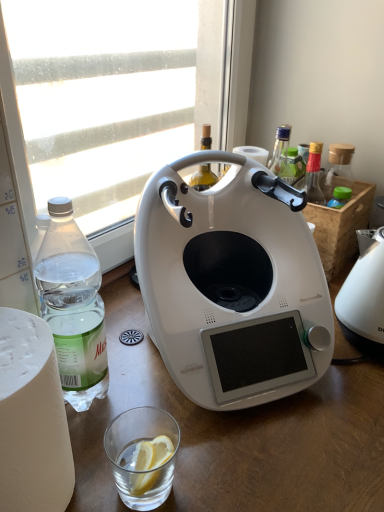
Question: Is transparent glass window at upper left thinner than clear plastic bottle at left?

Choices:
 (A) yes
 (B) no

Answer: (A)

Question: Are transparent glass window at upper left and clear plastic bottle at left making contact?

Choices:
 (A) yes
 (B) no

Answer: (B)

Question: Is transparent glass window at upper left aimed at clear plastic bottle at left?

Choices:
 (A) no
 (B) yes

Answer: (B)

Question: Is transparent glass window at upper left located outside clear plastic bottle at left?

Choices:
 (A) yes
 (B) no

Answer: (A)

Question: Is transparent glass window at upper left shorter than clear plastic bottle at left?

Choices:
 (A) yes
 (B) no

Answer: (B)

Question: Is transparent glass window at upper left facing away from clear plastic bottle at left?

Choices:
 (A) no
 (B) yes

Answer: (A)

Question: Could you tell me if white glossy coffee maker at center, which is counted as the first kitchen appliance, starting from the left, is turned towards clear glass at lower center?

Choices:
 (A) yes
 (B) no

Answer: (B)

Question: Considering the relative sizes of white glossy coffee maker at center, which is counted as the first kitchen appliance, starting from the left, and clear glass at lower center in the image provided, is white glossy coffee maker at center, which is counted as the first kitchen appliance, starting from the left, thinner than clear glass at lower center?

Choices:
 (A) yes
 (B) no

Answer: (B)

Question: Is white glossy coffee maker at center, which is counted as the first kitchen appliance, starting from the left, positioned beyond the bounds of clear glass at lower center?

Choices:
 (A) no
 (B) yes

Answer: (B)

Question: Considering the relative positions of white glossy coffee maker at center, which is counted as the first kitchen appliance, starting from the left, and clear glass at lower center in the image provided, is white glossy coffee maker at center, which is counted as the first kitchen appliance, starting from the left, behind clear glass at lower center?

Choices:
 (A) no
 (B) yes

Answer: (A)

Question: Can you confirm if white glossy coffee maker at center, which is the second kitchen appliance in right-to-left order, is taller than clear glass at lower center?

Choices:
 (A) yes
 (B) no

Answer: (A)

Question: Is white glossy coffee maker at center, which is counted as the first kitchen appliance, starting from the left, closer to camera compared to clear glass at lower center?

Choices:
 (A) yes
 (B) no

Answer: (A)

Question: Could white plastic kettle at right, placed as the 2th kitchen appliance when sorted from left to right, be considered to be inside clear plastic bottle at left?

Choices:
 (A) yes
 (B) no

Answer: (B)